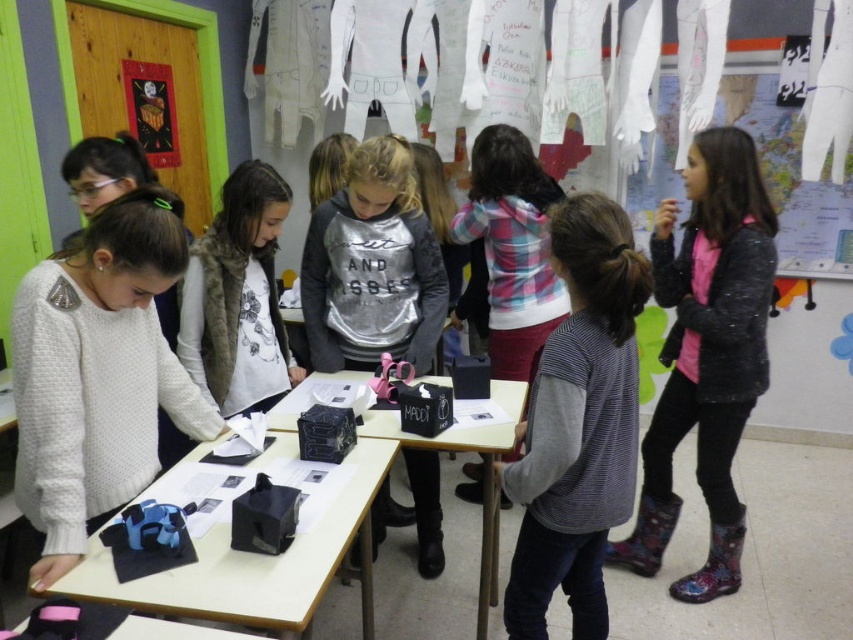
You are a teacher in the classroom and want to give a sticker to the child wearing the silver metallic sweatshirt at center and the fuzzy brown vest at center. Which child is wearing a larger clothing item?

The silver metallic sweatshirt at center is larger in size than the fuzzy brown vest at center, so the child wearing the silver metallic sweatshirt at center has a larger clothing item.

You are a teacher in the classroom. You want to place a new poster on the wall behind the white knitted sweater at center and the black plastic table at center. Can you place the poster directly behind both objects without moving them?

The white knitted sweater at center is in front of the black plastic table at center, so placing the poster directly behind both would require positioning it behind the black plastic table at center since the sweater is in front of it.

You are a teacher in the classroom and need to find the white knitted sweater at center. Where exactly is it located in the room?

The white knitted sweater at center is located at point (97, 374) in the room.